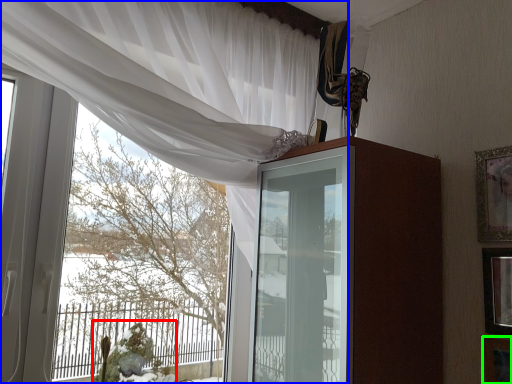
Question: Which object is positioned closest to floral arrangement (highlighted by a red box)? Select from curtain (highlighted by a blue box) and picture frame (highlighted by a green box).

Choices:
 (A) curtain
 (B) picture frame

Answer: (A)